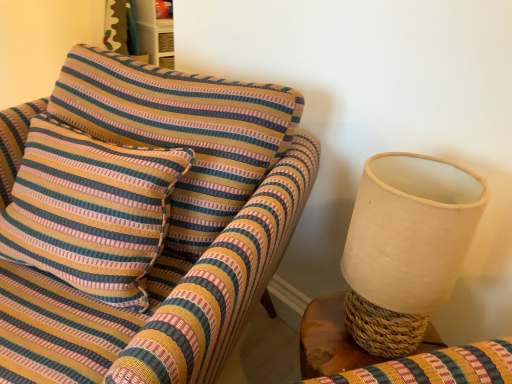
Question: Does striped fabric pillow at left have a larger size compared to woven wood table at right?

Choices:
 (A) no
 (B) yes

Answer: (B)

Question: Is striped fabric pillow at left not near woven wood table at right?

Choices:
 (A) no
 (B) yes

Answer: (A)

Question: From the image's perspective, is striped fabric pillow at left over woven wood table at right?

Choices:
 (A) yes
 (B) no

Answer: (A)

Question: From a real-world perspective, is striped fabric pillow at left located higher than woven wood table at right?

Choices:
 (A) yes
 (B) no

Answer: (A)

Question: Is woven wood table at right inside striped fabric pillow at left?

Choices:
 (A) no
 (B) yes

Answer: (A)

Question: Could you tell me if striped fabric pillow at left is facing woven wood table at right?

Choices:
 (A) yes
 (B) no

Answer: (B)

Question: Does striped fabric pillow at left have a greater height compared to white fabric lampshade at right?

Choices:
 (A) no
 (B) yes

Answer: (B)

Question: Is striped fabric pillow at left in contact with white fabric lampshade at right?

Choices:
 (A) no
 (B) yes

Answer: (A)

Question: From the image's perspective, is striped fabric pillow at left under white fabric lampshade at right?

Choices:
 (A) no
 (B) yes

Answer: (A)

Question: From a real-world perspective, is striped fabric pillow at left physically below white fabric lampshade at right?

Choices:
 (A) no
 (B) yes

Answer: (B)

Question: Is striped fabric pillow at left thinner than white fabric lampshade at right?

Choices:
 (A) yes
 (B) no

Answer: (B)

Question: Is striped fabric pillow at left not close to white fabric lampshade at right?

Choices:
 (A) yes
 (B) no

Answer: (B)

Question: From the image's perspective, is white fabric lampshade at right on top of woven wood table at right?

Choices:
 (A) yes
 (B) no

Answer: (A)